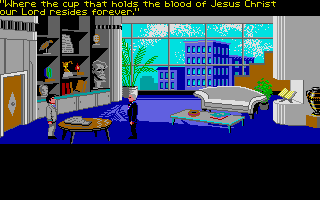
Find the location of a particular element. This screenshot has height=200, width=320. window is located at coordinates (170, 55).